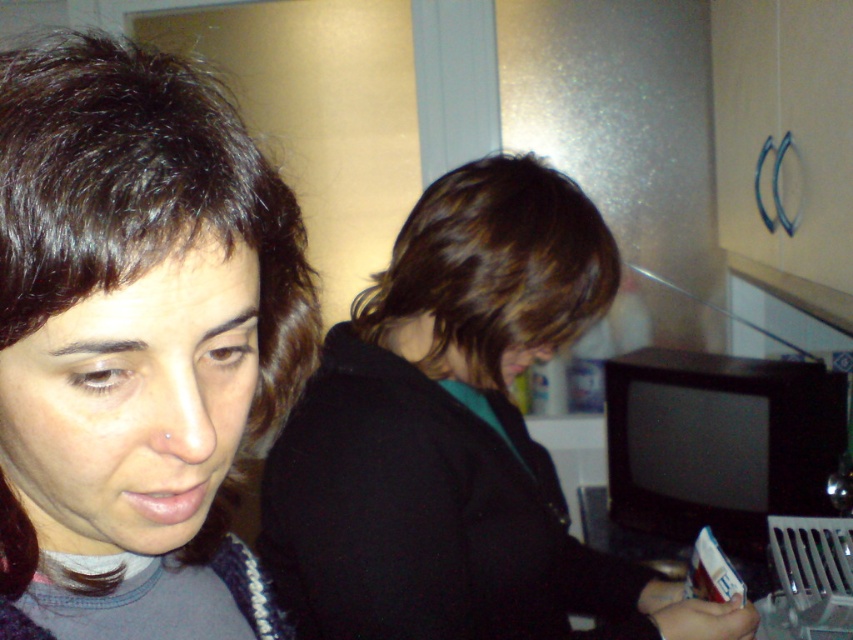
How far apart are dark brown hair at upper left and dark brown hair at center?

dark brown hair at upper left and dark brown hair at center are 17.56 inches apart.

Does point (206, 531) come closer to viewer compared to point (401, 456)?

Yes, point (206, 531) is in front of point (401, 456).

Image resolution: width=853 pixels, height=640 pixels. I want to click on dark brown hair at upper left, so click(x=135, y=342).

Where is `dark brown hair at upper left`? dark brown hair at upper left is located at coordinates click(135, 342).